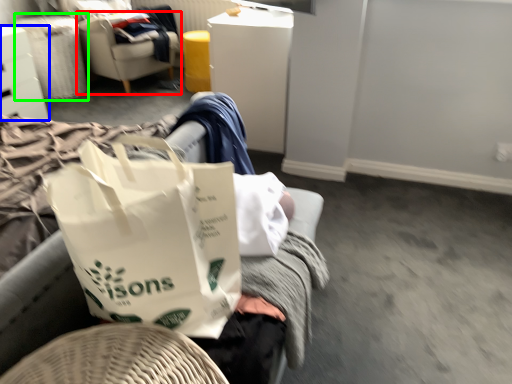
Question: Based on their relative distances, which object is nearer to chair (highlighted by a red box)? Choose from furniture (highlighted by a blue box) and laundry basket (highlighted by a green box).

Choices:
 (A) furniture
 (B) laundry basket

Answer: (B)